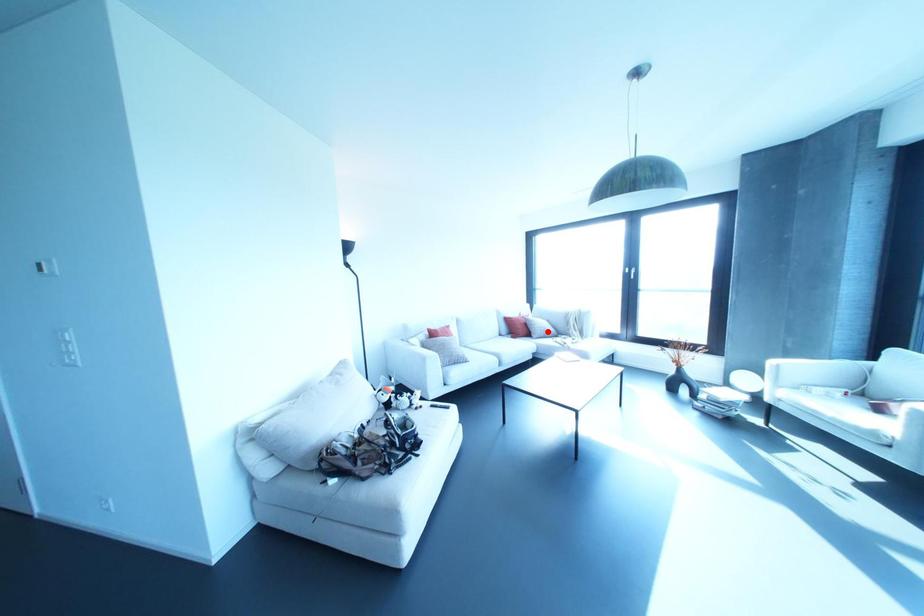
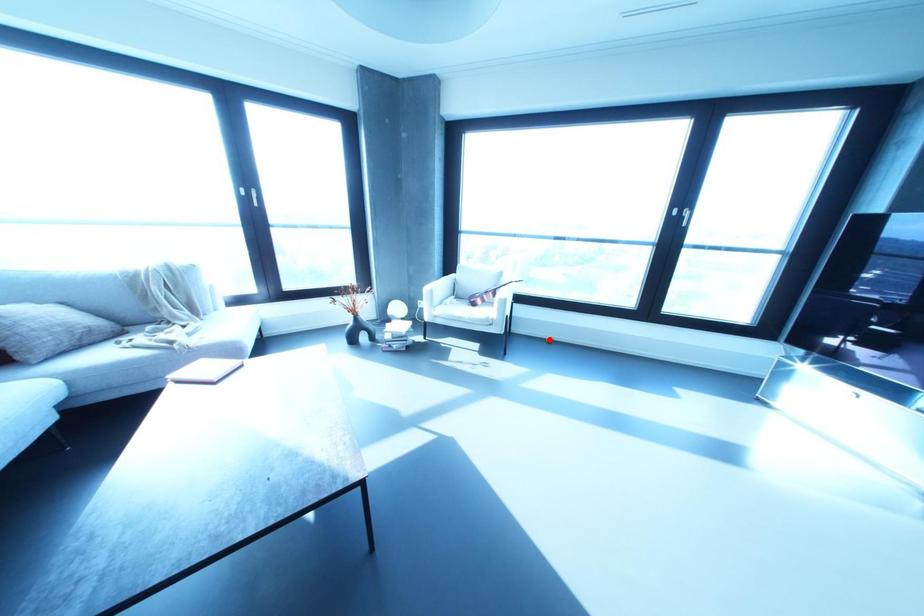
I am providing you with two images of the same scene from different viewpoints. A red point is marked on the first image and another point is marked on the second image. Is the marked point in image1 the same physical position as the marked point in image2?

No